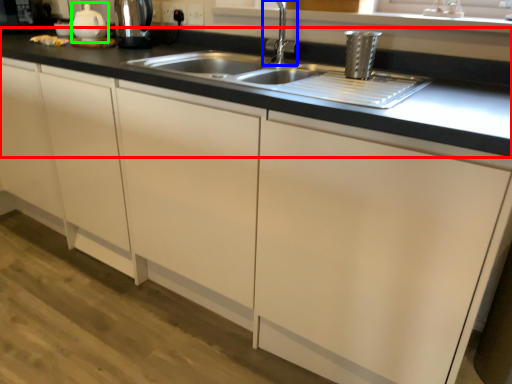
Question: Considering the real-world distances, which object is closest to countertop (highlighted by a red box)? tap (highlighted by a blue box) or tea pot (highlighted by a green box).

Choices:
 (A) tap
 (B) tea pot

Answer: (A)